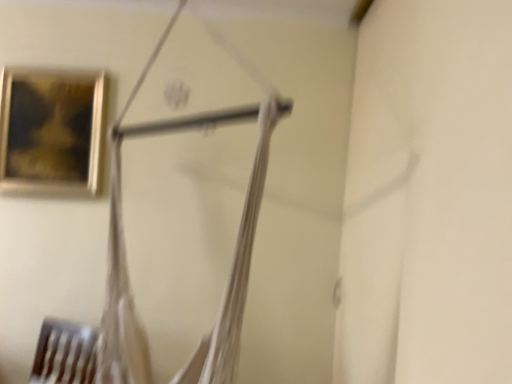
Question: Considering the relative sizes of gold-framed painting at upper left and white fabric hanger at center in the image provided, is gold-framed painting at upper left shorter than white fabric hanger at center?

Choices:
 (A) no
 (B) yes

Answer: (B)

Question: From a real-world perspective, is gold-framed painting at upper left below white fabric hanger at center?

Choices:
 (A) yes
 (B) no

Answer: (B)

Question: Considering the relative sizes of gold-framed painting at upper left and white fabric hanger at center in the image provided, is gold-framed painting at upper left thinner than white fabric hanger at center?

Choices:
 (A) no
 (B) yes

Answer: (B)

Question: From a real-world perspective, is gold-framed painting at upper left physically above white fabric hanger at center?

Choices:
 (A) yes
 (B) no

Answer: (A)

Question: From the image's perspective, does gold-framed painting at upper left appear higher than white fabric hanger at center?

Choices:
 (A) no
 (B) yes

Answer: (B)

Question: Does gold-framed painting at upper left appear on the left side of white fabric hanger at center?

Choices:
 (A) yes
 (B) no

Answer: (A)

Question: Is white fabric hanger at center behind gold-framed painting at upper left?

Choices:
 (A) no
 (B) yes

Answer: (A)

Question: Does white fabric hanger at center appear on the left side of gold-framed painting at upper left?

Choices:
 (A) no
 (B) yes

Answer: (A)

Question: Does white fabric hanger at center turn towards gold-framed painting at upper left?

Choices:
 (A) yes
 (B) no

Answer: (B)

Question: From the image's perspective, would you say white fabric hanger at center is shown under gold-framed painting at upper left?

Choices:
 (A) no
 (B) yes

Answer: (B)

Question: Considering the relative sizes of white fabric hanger at center and gold-framed painting at upper left in the image provided, is white fabric hanger at center taller than gold-framed painting at upper left?

Choices:
 (A) no
 (B) yes

Answer: (B)

Question: From a real-world perspective, is white fabric hanger at center physically above gold-framed painting at upper left?

Choices:
 (A) yes
 (B) no

Answer: (B)

Question: Visually, is white fabric hanger at center positioned to the left or to the right of gold-framed painting at upper left?

Choices:
 (A) right
 (B) left

Answer: (A)